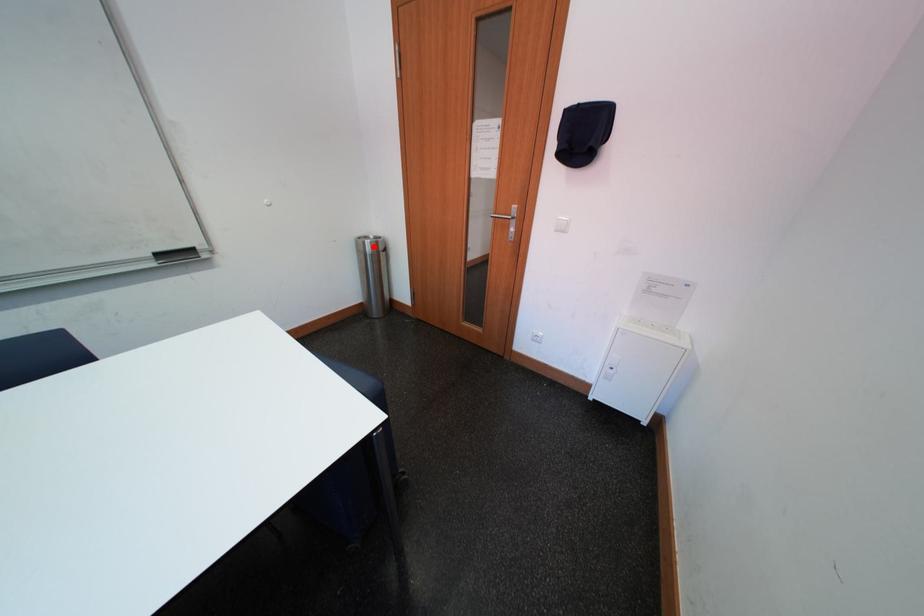
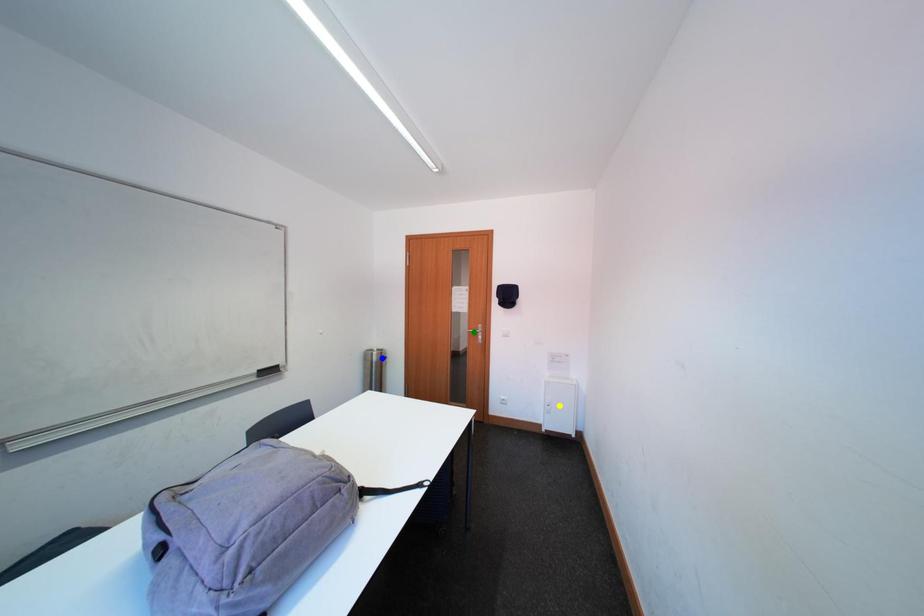
Question: I am providing you with two images of the same scene from different viewpoints. A red point is marked on the first image. You are given multiple points on the second image. In image 2, which mark is for the same physical point as the one in image 1?

Choices:
 (A) green point
 (B) yellow point
 (C) blue point

Answer: (C)